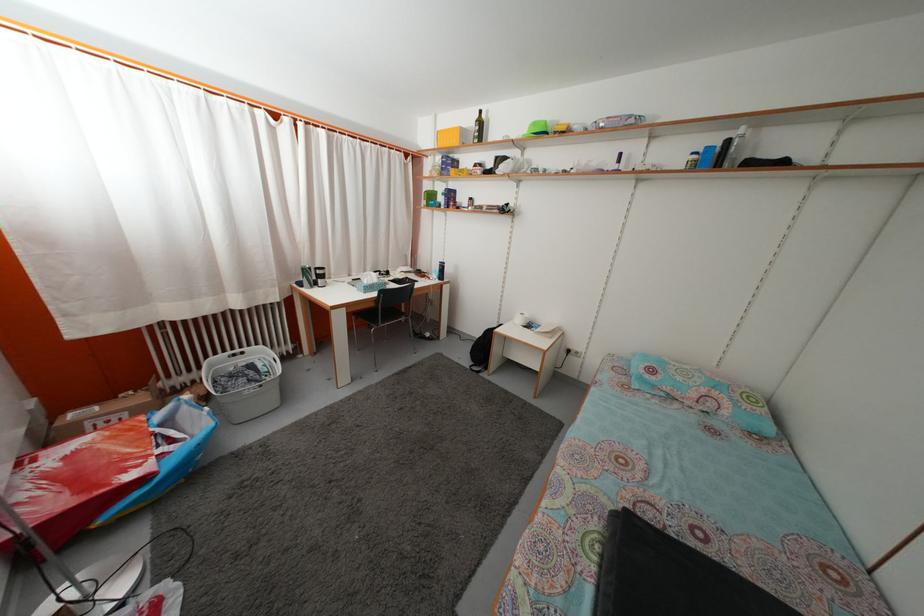
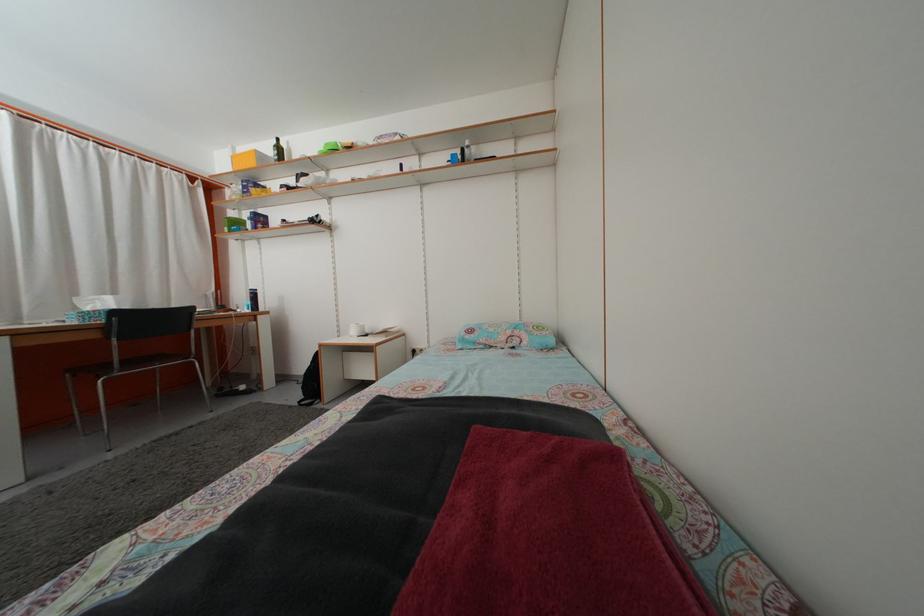
Locate, in the second image, the point that corresponds to point 699,402 in the first image.

(508, 346)